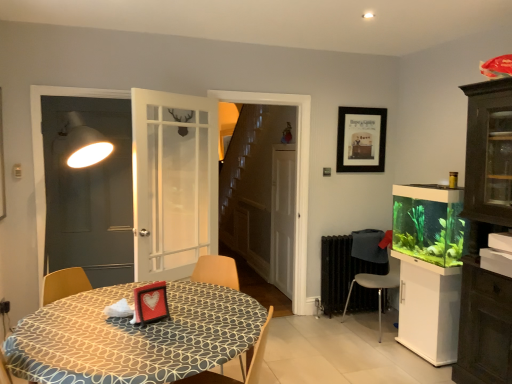
Question: Is matte white screen door at left, positioned as the second screen door in right-to-left order, in contact with black matte picture frame at upper center?

Choices:
 (A) yes
 (B) no

Answer: (B)

Question: Would you consider matte white screen door at left, positioned as the second screen door in right-to-left order, to be distant from black matte picture frame at upper center?

Choices:
 (A) yes
 (B) no

Answer: (A)

Question: Is matte white screen door at left, the 1th screen door in the left-to-right sequence, facing away from black matte picture frame at upper center?

Choices:
 (A) yes
 (B) no

Answer: (B)

Question: Is matte white screen door at left, the 1th screen door in the left-to-right sequence, positioned beyond the bounds of black matte picture frame at upper center?

Choices:
 (A) no
 (B) yes

Answer: (B)

Question: Is matte white screen door at left, positioned as the second screen door in right-to-left order, facing towards black matte picture frame at upper center?

Choices:
 (A) yes
 (B) no

Answer: (B)

Question: From the image's perspective, is matte white screen door at left, positioned as the second screen door in right-to-left order, on top of black matte picture frame at upper center?

Choices:
 (A) no
 (B) yes

Answer: (A)

Question: From the image's perspective, is matte white screen door at left, the 1th screen door in the left-to-right sequence, under metallic gray chair at lower right, arranged as the second chair when viewed from the left?

Choices:
 (A) no
 (B) yes

Answer: (A)

Question: From the image's perspective, does matte white screen door at left, marked as the 2th screen door in a back-to-front arrangement, appear higher than metallic gray chair at lower right, positioned as the second chair in front-to-back order?

Choices:
 (A) no
 (B) yes

Answer: (B)

Question: Is matte white screen door at left, the 1th screen door in the left-to-right sequence, directly adjacent to metallic gray chair at lower right, the first chair positioned from the back?

Choices:
 (A) yes
 (B) no

Answer: (B)

Question: Considering the relative positions of matte white screen door at left, positioned as the second screen door in right-to-left order, and metallic gray chair at lower right, acting as the 1th chair starting from the right, in the image provided, is matte white screen door at left, positioned as the second screen door in right-to-left order, to the right of metallic gray chair at lower right, acting as the 1th chair starting from the right, from the viewer's perspective?

Choices:
 (A) yes
 (B) no

Answer: (B)

Question: Does matte white screen door at left, the 1th screen door in the left-to-right sequence, have a smaller size compared to metallic gray chair at lower right, positioned as the second chair in front-to-back order?

Choices:
 (A) yes
 (B) no

Answer: (A)

Question: Is metallic gray chair at lower right, arranged as the second chair when viewed from the left, completely or partially inside matte white screen door at left, the 1th screen door in the left-to-right sequence?

Choices:
 (A) yes
 (B) no

Answer: (B)

Question: Can you confirm if white matte screen door at center, positioned as the second screen door in left-to-right order, is positioned to the right of green matte aquarium at right?

Choices:
 (A) yes
 (B) no

Answer: (B)